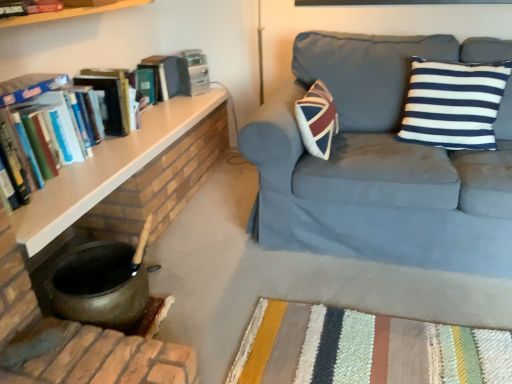
I want to click on free space above wooden shelf at left (from a real-world perspective), so click(117, 147).